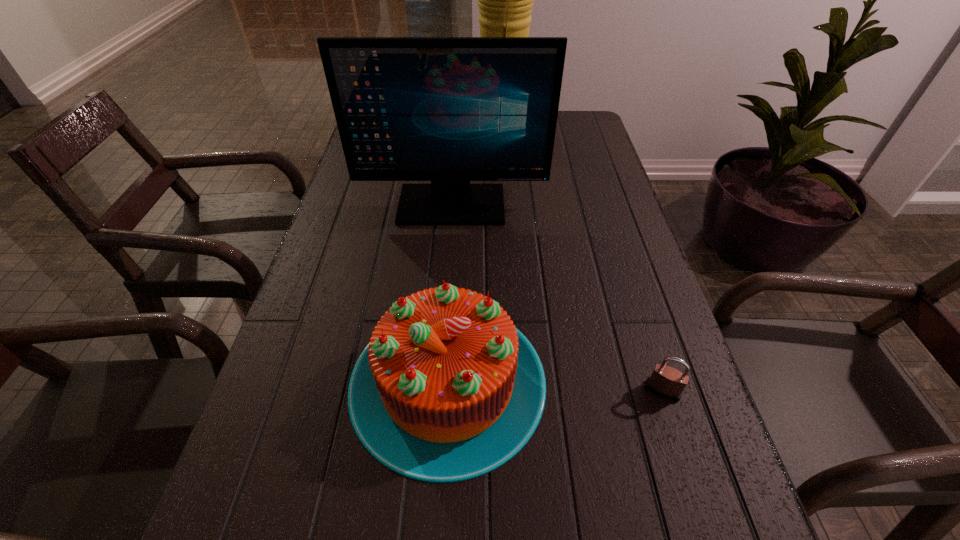
Locate an element on the screen. The image size is (960, 540). vacant space positioned 0.320m on the screen side of the third nearest object is located at coordinates (443, 332).

Locate an element on the screen. The width and height of the screenshot is (960, 540). vacant space located on the left of the cake is located at coordinates (321, 381).

The image size is (960, 540). Identify the location of free region located 0.050m on the left of the rightmost object. (616, 390).

At what (x,y) coordinates should I click in order to perform the action: click on object located in the far edge section of the desktop. Please return your answer as a coordinate pair (x, y). The height and width of the screenshot is (540, 960). Looking at the image, I should click on (505, 0).

At what (x,y) coordinates should I click in order to perform the action: click on monitor that is positioned at the left edge. Please return your answer as a coordinate pair (x, y). Image resolution: width=960 pixels, height=540 pixels. Looking at the image, I should click on (450, 110).

Find the location of a particular element. Image resolution: width=960 pixels, height=540 pixels. cake at the left edge is located at coordinates (448, 389).

You are a GUI agent. You are given a task and a screenshot of the screen. Output one action in this format:
    pyautogui.click(x=<x>, y=<y>)
    Task: Click on the object present at the right edge
    
    Given the screenshot: What is the action you would take?
    pyautogui.click(x=666, y=382)

At what (x,y) coordinates should I click in order to perform the action: click on vacant space at the left edge of the desktop. Please return your answer as a coordinate pair (x, y). This screenshot has height=540, width=960. Looking at the image, I should click on (289, 510).

Where is `vacant area at the right edge of the desktop`? The image size is (960, 540). vacant area at the right edge of the desktop is located at coordinates (639, 532).

The image size is (960, 540). In the image, there is a desktop. What are the coordinates of `free space at the far right corner` in the screenshot? It's located at (564, 139).